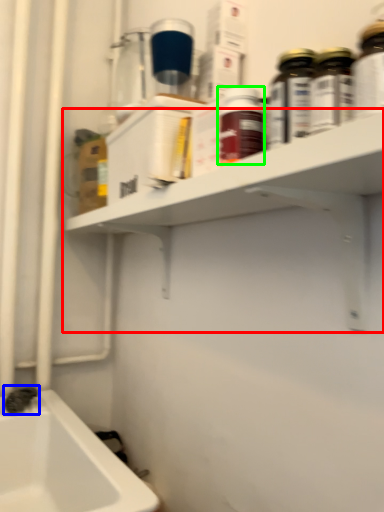
Question: Considering the real-world distances, which object is farthest from shelf (highlighted by a red box)? plumbing fixture (highlighted by a blue box) or bottle (highlighted by a green box)?

Choices:
 (A) plumbing fixture
 (B) bottle

Answer: (A)